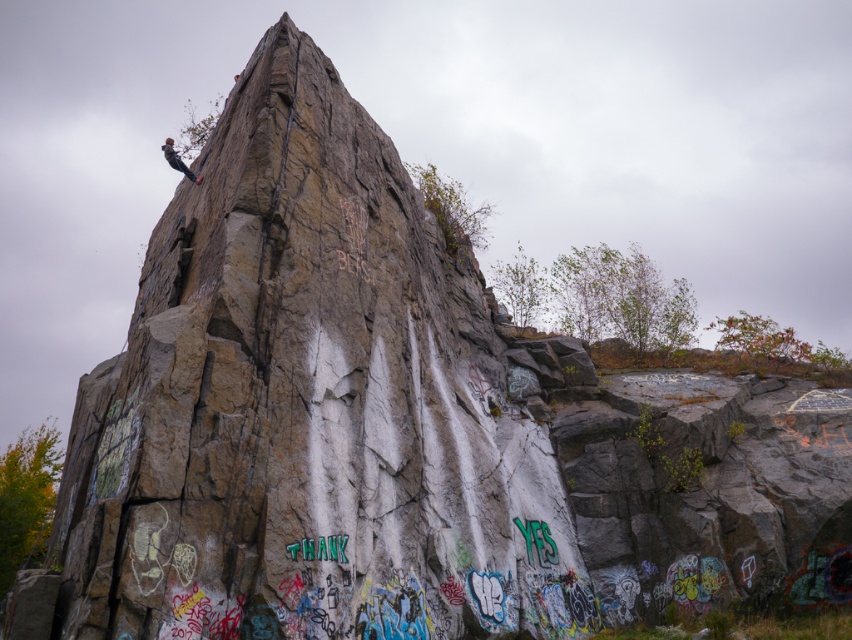
Question: Does rough stone rock at center appear over matte black rock climber at upper left?

Choices:
 (A) yes
 (B) no

Answer: (B)

Question: Which point is farther from the camera taking this photo?

Choices:
 (A) (170, 150)
 (B) (465, 472)

Answer: (A)

Question: Which object appears closest to the camera in this image?

Choices:
 (A) matte black rock climber at upper left
 (B) rough stone rock at center

Answer: (B)

Question: Can you confirm if rough stone rock at center is wider than matte black rock climber at upper left?

Choices:
 (A) no
 (B) yes

Answer: (B)

Question: Does rough stone rock at center have a lesser width compared to matte black rock climber at upper left?

Choices:
 (A) yes
 (B) no

Answer: (B)